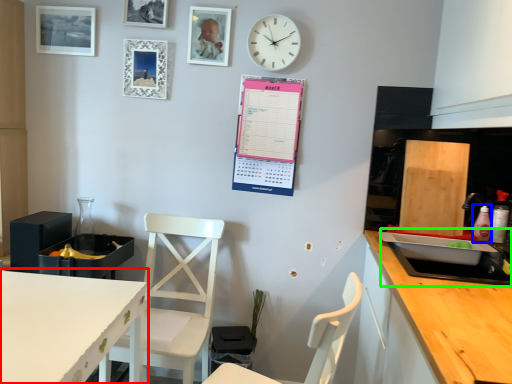
Question: Estimate the real-world distances between objects in this image. Which object is closer to countertop (highlighted by a red box), bottle (highlighted by a blue box) or sink (highlighted by a green box)?

Choices:
 (A) bottle
 (B) sink

Answer: (B)